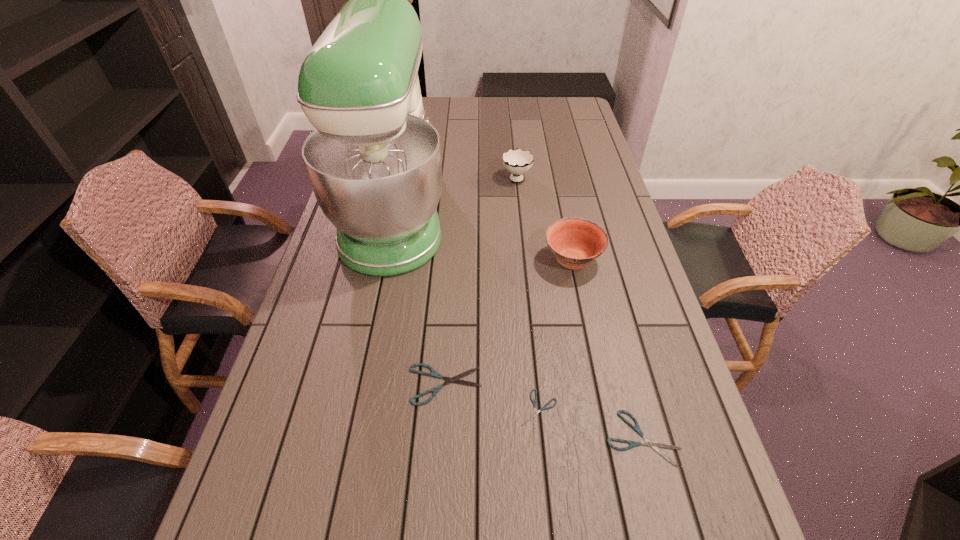
Locate an element on the screen. Image resolution: width=960 pixels, height=540 pixels. vacant space that satisfies the following two spatial constraints: 1. on the controls of the tallest object; 2. on the back side of the bowl is located at coordinates (386, 261).

Where is `free space that satisfies the following two spatial constraints: 1. on the controls of the second shears from right to left; 2. on the left side of the mixer`? The width and height of the screenshot is (960, 540). free space that satisfies the following two spatial constraints: 1. on the controls of the second shears from right to left; 2. on the left side of the mixer is located at coordinates (353, 410).

Locate an element on the screen. Image resolution: width=960 pixels, height=540 pixels. blank space that satisfies the following two spatial constraints: 1. on the controls of the rightmost shears; 2. on the left side of the mixer is located at coordinates (348, 438).

Locate an element on the screen. This screenshot has width=960, height=540. vacant space that satisfies the following two spatial constraints: 1. on the back side of the bowl; 2. on the left side of the leftmost shears is located at coordinates (453, 261).

Where is `vacant space that satisfies the following two spatial constraints: 1. on the back side of the shortest shears; 2. on the controls of the tallest object`? vacant space that satisfies the following two spatial constraints: 1. on the back side of the shortest shears; 2. on the controls of the tallest object is located at coordinates (520, 216).

At what (x,y) coordinates should I click in order to perform the action: click on free space that satisfies the following two spatial constraints: 1. on the front side of the bowl; 2. on the right side of the second shortest object. Please return your answer as a coordinate pair (x, y). This screenshot has width=960, height=540. Looking at the image, I should click on (610, 438).

The width and height of the screenshot is (960, 540). Find the location of `free location that satisfies the following two spatial constraints: 1. on the controls of the bowl; 2. on the left side of the mixer`. free location that satisfies the following two spatial constraints: 1. on the controls of the bowl; 2. on the left side of the mixer is located at coordinates (386, 261).